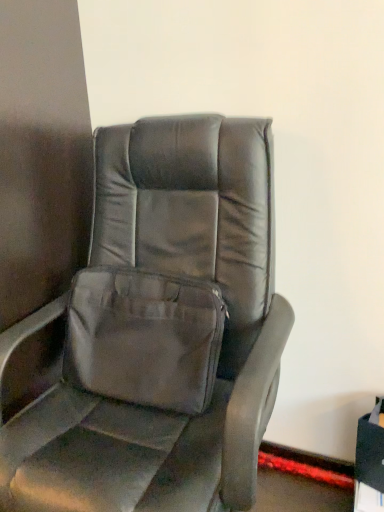
In the scene shown: Measure the distance between matte black chair at center and camera.

The depth of matte black chair at center is 29.03 inches.

The height and width of the screenshot is (512, 384). Describe the element at coordinates (140, 319) in the screenshot. I see `matte black chair at center` at that location.

Locate an element on the screen. Image resolution: width=384 pixels, height=512 pixels. matte black chair at center is located at coordinates (140, 319).

Where is `matte black chair at center`? matte black chair at center is located at coordinates (140, 319).